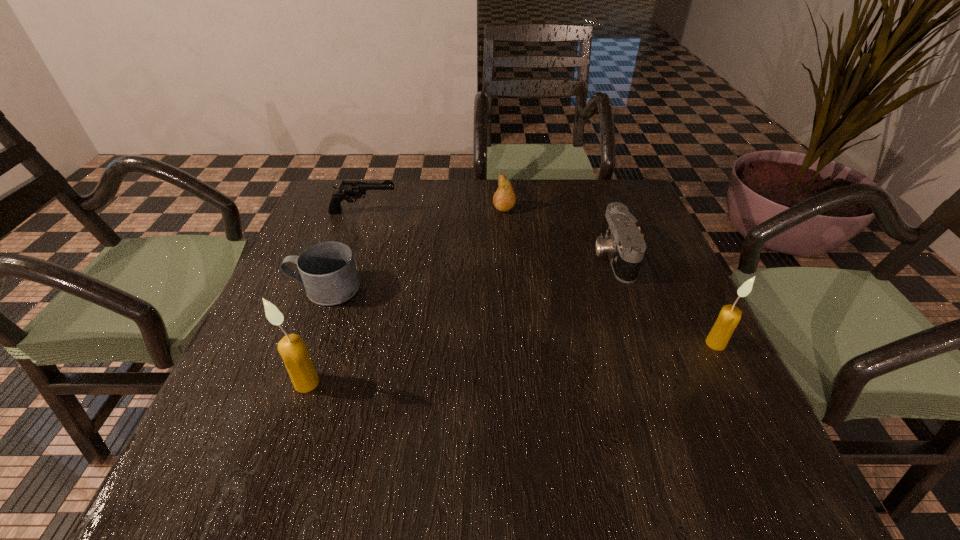
At what (x,y) coordinates should I click in order to perform the action: click on mug that is at the left edge. Please return your answer as a coordinate pair (x, y). The image size is (960, 540). Looking at the image, I should click on (327, 270).

Where is `candle located in the right edge section of the desktop`? Image resolution: width=960 pixels, height=540 pixels. candle located in the right edge section of the desktop is located at coordinates (730, 315).

Where is `camera positioned at the right edge`? camera positioned at the right edge is located at coordinates (621, 239).

Where is `object located at the far left corner`? object located at the far left corner is located at coordinates (348, 190).

Find the location of `object present at the near left corner`. object present at the near left corner is located at coordinates (292, 348).

In the image, there is a desktop. Identify the location of vacant area at the far edge. (455, 206).

At what (x,y) coordinates should I click in order to perform the action: click on free space at the near edge. Please return your answer as a coordinate pair (x, y). This screenshot has width=960, height=540. Looking at the image, I should click on (450, 400).

Identify the location of vacant space at the left edge of the desktop. This screenshot has width=960, height=540. (331, 332).

Image resolution: width=960 pixels, height=540 pixels. Identify the location of free space at the far right corner. (608, 201).

At what (x,y) coordinates should I click in order to perform the action: click on free area in between the fifth farthest object and the mug. Please return your answer as a coordinate pair (x, y). Looking at the image, I should click on (520, 316).